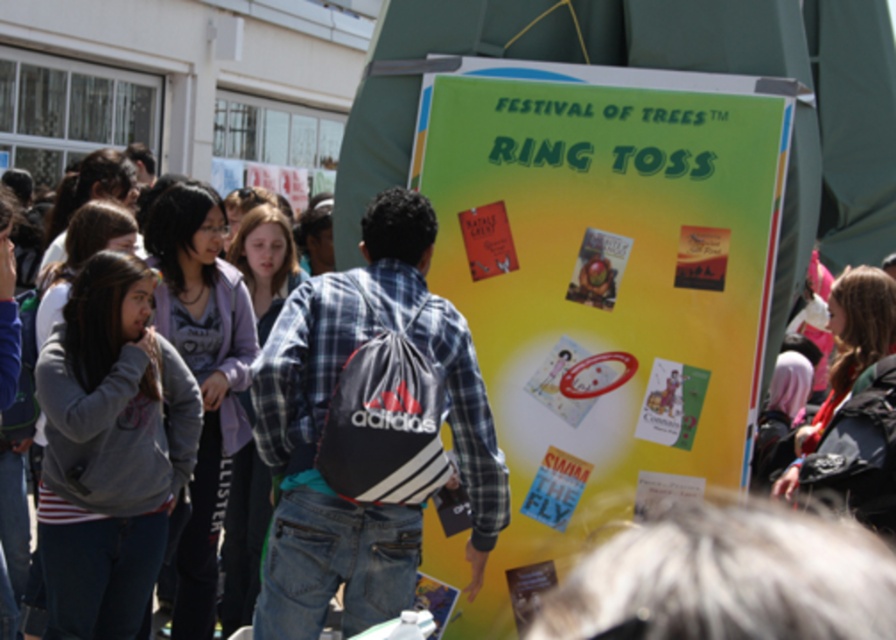
Question: Does plaid shirt at center come behind denim jacket at left?

Choices:
 (A) no
 (B) yes

Answer: (A)

Question: Is yellow paper poster at center wider than gray fleece jacket at center?

Choices:
 (A) yes
 (B) no

Answer: (A)

Question: Which of the following is the farthest from the observer?

Choices:
 (A) gray fleece jacket at center
 (B) plaid shirt at center
 (C) yellow paper poster at center

Answer: (A)

Question: Considering the real-world distances, which object is farthest from the yellow paper poster at center?

Choices:
 (A) plaid shirt at center
 (B) gray fleece jacket at center
 (C) denim jacket at left

Answer: (C)

Question: Does yellow paper poster at center appear on the right side of denim jacket at left?

Choices:
 (A) no
 (B) yes

Answer: (B)

Question: Which is nearer to the yellow paper poster at center?

Choices:
 (A) plaid shirt at center
 (B) gray fleece jacket at center

Answer: (A)